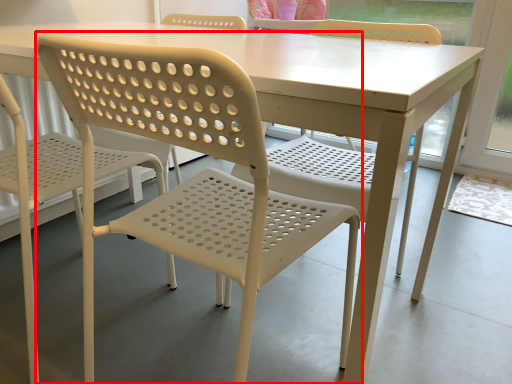
Question: In this image, where is chair (annotated by the red box) located relative to chair?

Choices:
 (A) left
 (B) right

Answer: (B)